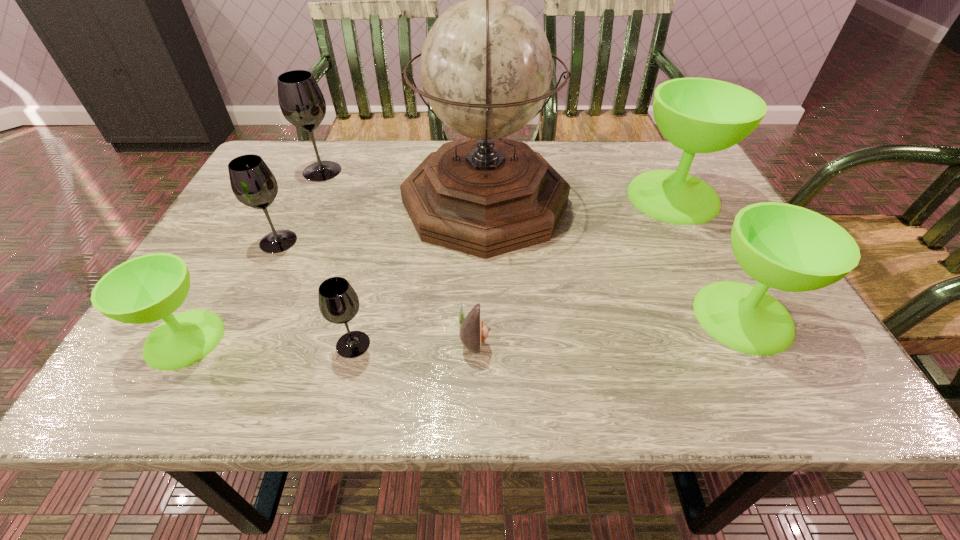
You are a GUI agent. You are given a task and a screenshot of the screen. Output one action in this format:
    pyautogui.click(x=<x>, y=<y>)
    Task: Click on the vacant point that satisfies the following two spatial constraints: 1. on the back side of the second farthest gray wineglass; 2. on the left side of the smallest green wineglass
    The width and height of the screenshot is (960, 540).
    Given the screenshot: What is the action you would take?
    pyautogui.click(x=240, y=241)